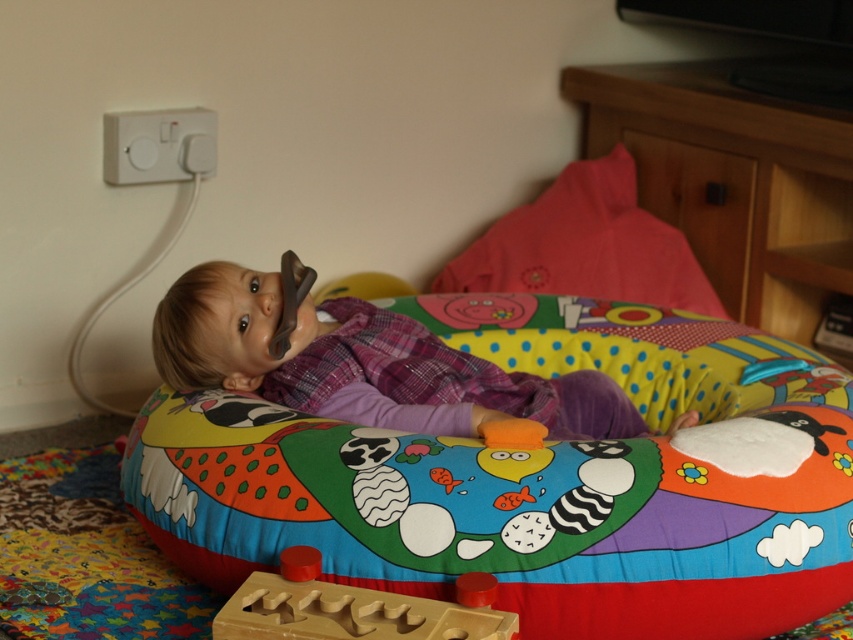
Question: Which is farther from the multicolored fabric bean bag at center?

Choices:
 (A) soft pink pillow at upper center
 (B) wooden puzzle piece at lower center
 (C) matte plastic baby at center

Answer: (A)

Question: Is multicolored fabric bean bag at center bigger than matte plastic baby at center?

Choices:
 (A) yes
 (B) no

Answer: (A)

Question: Can you confirm if matte plastic baby at center is smaller than wooden puzzle piece at lower center?

Choices:
 (A) no
 (B) yes

Answer: (A)

Question: Which is nearer to the soft pink pillow at upper center?

Choices:
 (A) matte plastic baby at center
 (B) multicolored fabric bean bag at center

Answer: (B)

Question: Which is farther from the soft pink pillow at upper center?

Choices:
 (A) matte plastic baby at center
 (B) wooden puzzle piece at lower center

Answer: (B)

Question: Does multicolored fabric bean bag at center have a larger size compared to matte plastic baby at center?

Choices:
 (A) no
 (B) yes

Answer: (B)